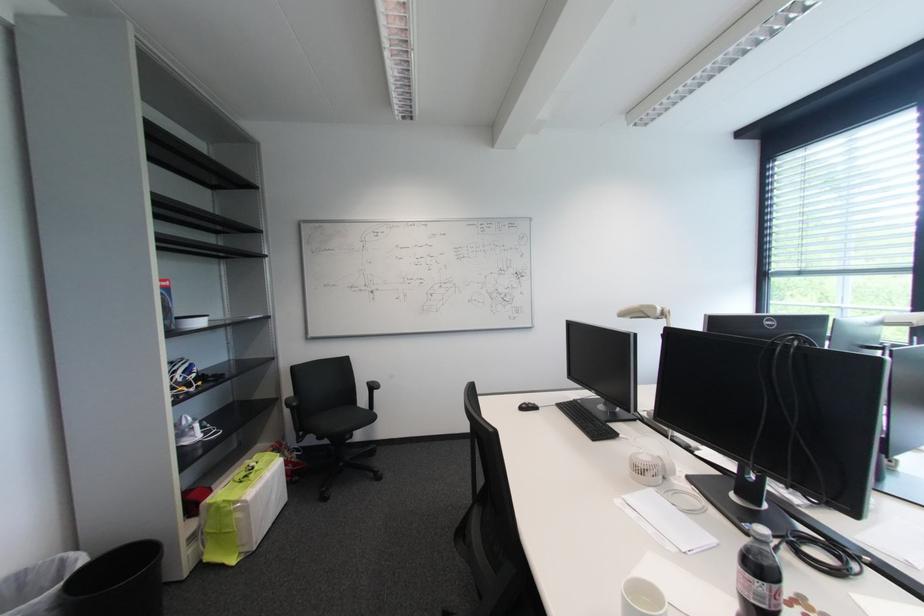
The image size is (924, 616). In order to click on telephone receiver in this screenshot , I will do `click(646, 312)`.